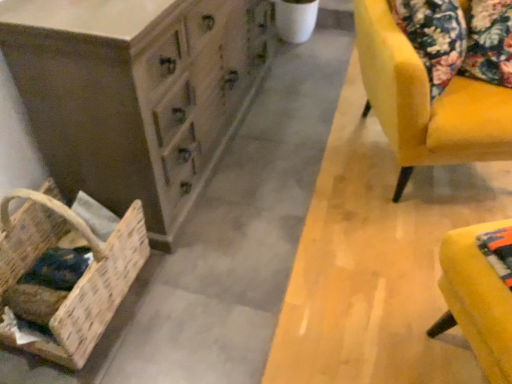
Locate an element on the screen. Image resolution: width=512 pixels, height=384 pixels. vacant area that lies between wooden chest of drawers at lower left and woven wood basket at lower left is located at coordinates coord(142,298).